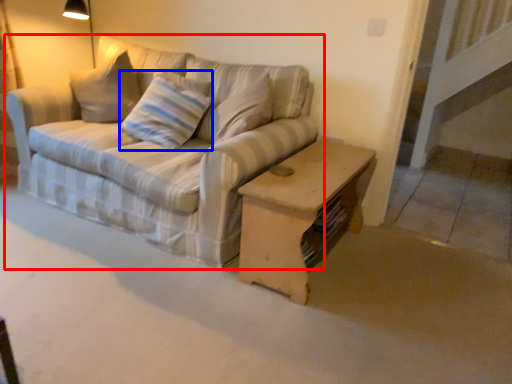
Question: Which object appears farthest to the camera in this image, studio couch (highlighted by a red box) or pillow (highlighted by a blue box)?

Choices:
 (A) studio couch
 (B) pillow

Answer: (B)